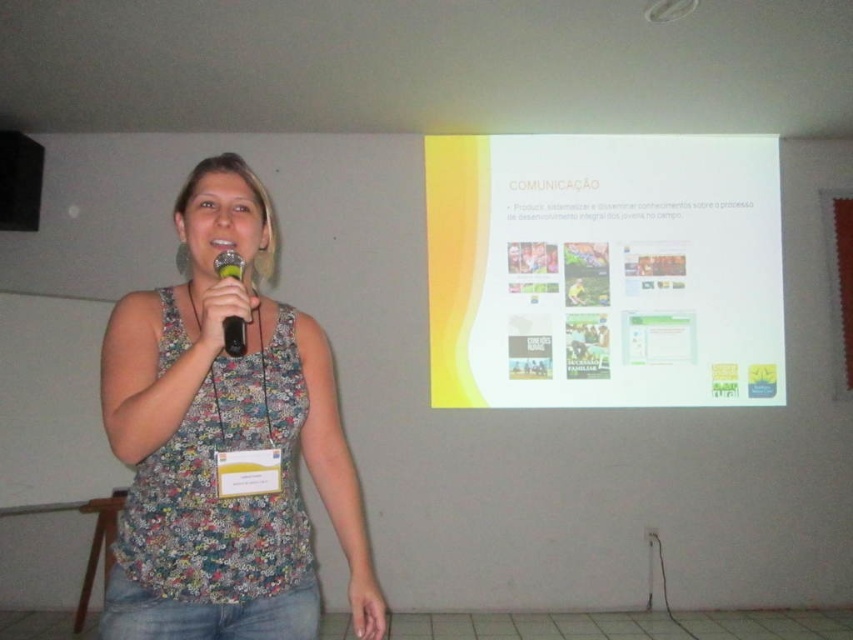
You are an event organizer who needs to ensure that all participants can clearly see the yellow matte projector screen at upper center and the floral fabric tank top at center during the presentation. Based on their sizes, which object might be more challenging to see from the back of the room?

The floral fabric tank top at center is smaller than the yellow matte projector screen at upper center, so it might be more challenging to see from the back of the room.

You are an event organizer setting up a presentation. You need to ensure the microphone is positioned correctly for the speaker. Based on the image, where is the floral fabric tank top at center in relation to the matte black microphone at center?

Answer: The floral fabric tank top at center is located below the matte black microphone at center.

What is the 2D coordinate of the yellow matte projector screen at upper center?

The yellow matte projector screen at upper center is located at the 2D coordinate point of (604, 269).